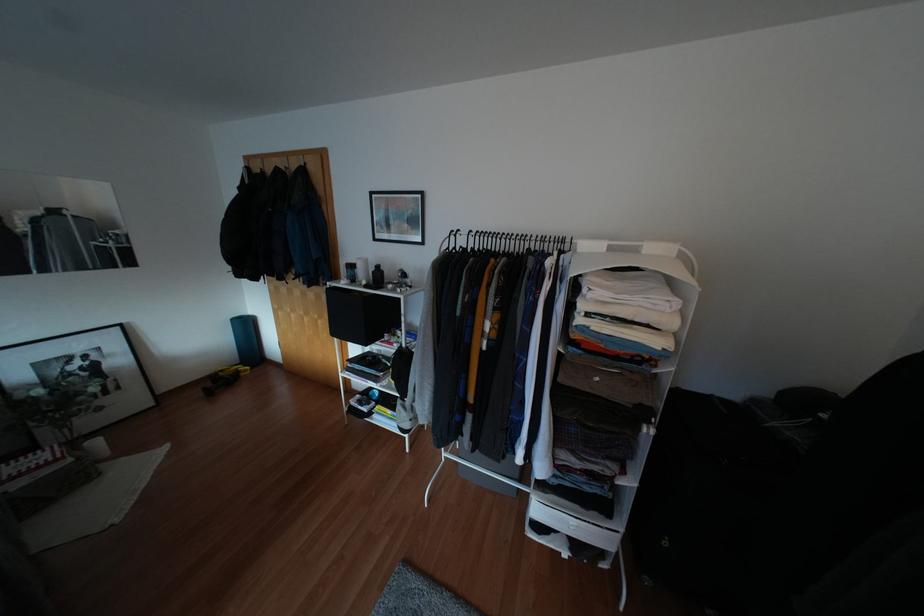
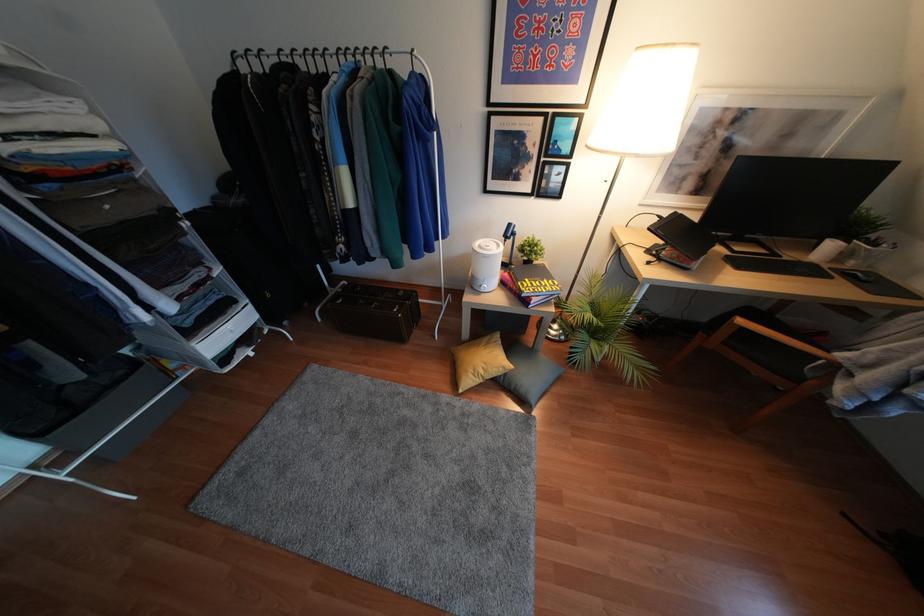
Based on the continuous images, in which direction is the camera rotating?

The rotation direction of the camera is right-down.